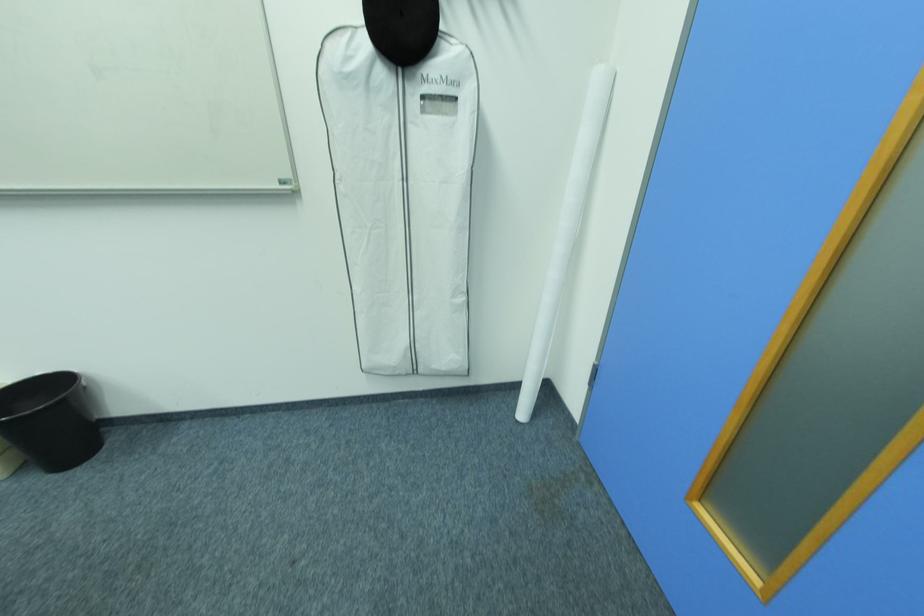
Where is `black trash can`? black trash can is located at coordinates (50, 419).